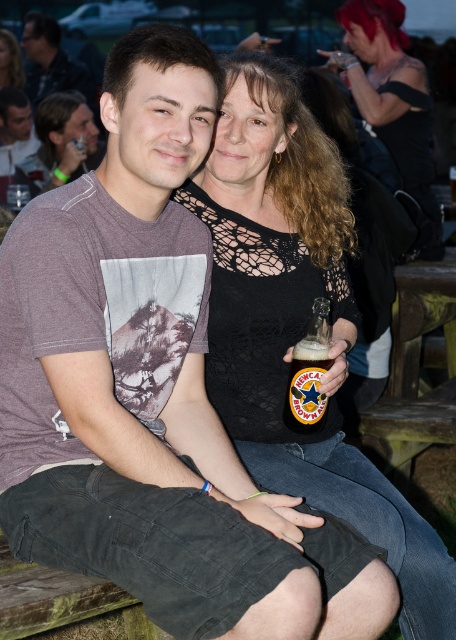
Is translucent glass bottle at center shorter than matte black shirt at upper left?

Yes, translucent glass bottle at center is shorter than matte black shirt at upper left.

Is translucent glass bottle at center taller than matte black shirt at upper left?

No.

Is point (286, 388) positioned in front of point (31, 99)?

That is True.

Locate an element on the screen. Image resolution: width=456 pixels, height=640 pixels. translucent glass bottle at center is located at coordinates (309, 372).

What are the coordinates of `black lace top at center` in the screenshot? It's located at (296, 321).

Is point (390, 561) in front of point (84, 131)?

Yes, point (390, 561) is in front of point (84, 131).

Locate an element on the screen. The height and width of the screenshot is (640, 456). black lace top at center is located at coordinates (296, 321).

Does matte gray t-shirt at left come in front of translucent glass bottle at center?

No.

Is matte gray t-shirt at left to the left of translucent glass bottle at center from the viewer's perspective?

Indeed, matte gray t-shirt at left is positioned on the left side of translucent glass bottle at center.

Is point (72, 99) positioned behind point (330, 362)?

Yes, point (72, 99) is behind point (330, 362).

This screenshot has height=640, width=456. I want to click on matte gray t-shirt at left, so click(x=61, y=144).